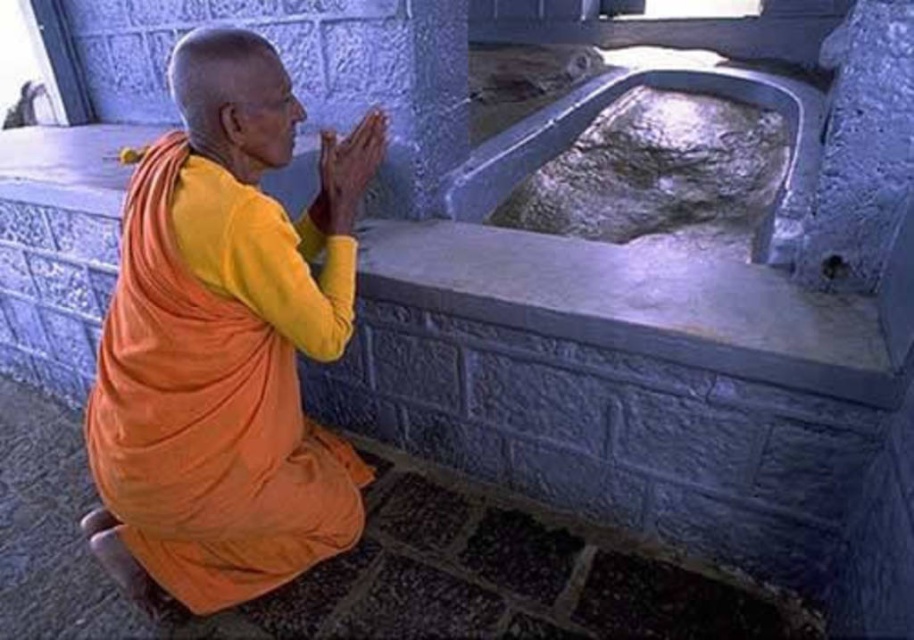
You are a photographer trying to capture the orange cloth at center and the matte orange hands at center in a single shot. Based on their positions, can you determine which object is closer to the camera?

The orange cloth at center is in front of matte orange hands at center, so the orange cloth at center is closer to the camera.

You are standing in a sacred area with a stone basin and a monk in orange robes. You need to place a small offering on the exact spot where the orange cloth at center is located. According to the coordinates provided, where should you place the offering?

The orange cloth at center should be placed at the coordinates point (225, 342).

You are an observer standing in front of the scene. You notice the orange cloth at center and the matte orange hands at center. Which object is taller?

The orange cloth at center is taller than the matte orange hands at center.